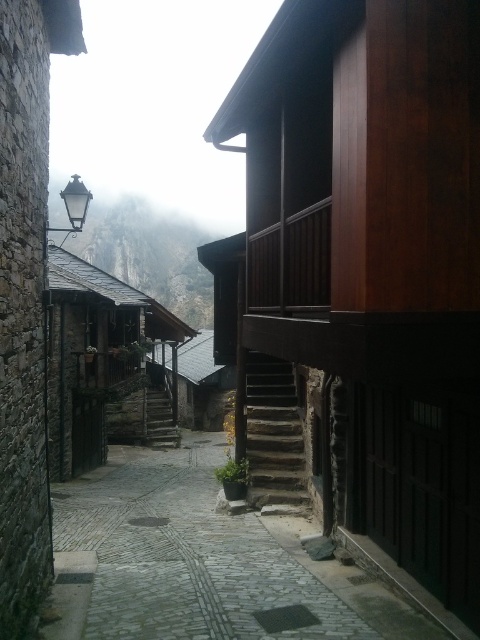
Question: Estimate the real-world distances between objects in this image. Which object is farther from the cobblestone path at center?

Choices:
 (A) rugged stone mountain at upper left
 (B) stone textured stairs at center

Answer: (A)

Question: Does cobblestone path at center have a larger size compared to stone textured stairs at center?

Choices:
 (A) yes
 (B) no

Answer: (A)

Question: Which of the following is the closest to the observer?

Choices:
 (A) cobblestone path at center
 (B) rugged stone mountain at upper left

Answer: (A)

Question: Which object appears farthest from the camera in this image?

Choices:
 (A) stone textured stairs at center
 (B) rugged stone mountain at upper left

Answer: (B)

Question: Is the position of rugged stone mountain at upper left less distant than that of stone textured stairs at center?

Choices:
 (A) yes
 (B) no

Answer: (B)

Question: Can you confirm if rugged stone mountain at upper left is wider than stone textured stairs at center?

Choices:
 (A) yes
 (B) no

Answer: (A)